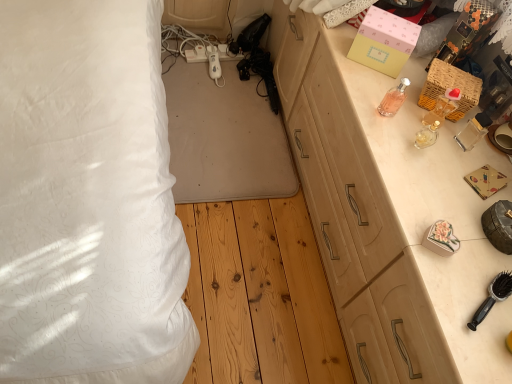
This screenshot has height=384, width=512. I want to click on free space to the back side of black plastic brush at lower right, so click(463, 233).